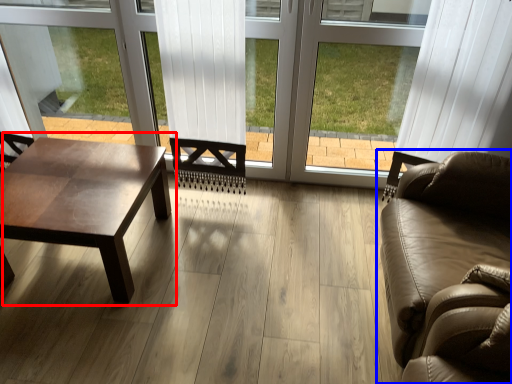
Question: Which object is further to the camera taking this photo, coffee table (highlighted by a red box) or studio couch (highlighted by a blue box)?

Choices:
 (A) coffee table
 (B) studio couch

Answer: (A)